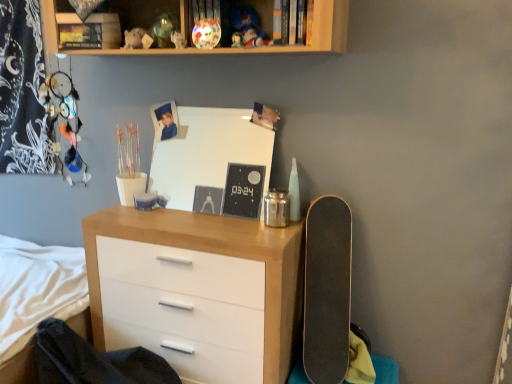
Question: Considering the positions of matte white figurine at upper center and wooden shelf at upper center in the image, is matte white figurine at upper center wider or thinner than wooden shelf at upper center?

Choices:
 (A) thin
 (B) wide

Answer: (A)

Question: Considering the relative positions of matte white figurine at upper center and wooden shelf at upper center in the image provided, is matte white figurine at upper center to the left or to the right of wooden shelf at upper center?

Choices:
 (A) left
 (B) right

Answer: (A)

Question: Considering the real-world distances, which object is closest to the hardcover book at upper center?

Choices:
 (A) wooden shelf at upper center
 (B) wooden chest of drawers at center
 (C) black matte skateboard at right
 (D) matte white figurine at upper center

Answer: (A)

Question: Which is farther from the wooden chest of drawers at center?

Choices:
 (A) black matte skateboard at right
 (B) matte white figurine at upper center
 (C) hardcover book at upper center
 (D) wooden shelf at upper center

Answer: (C)